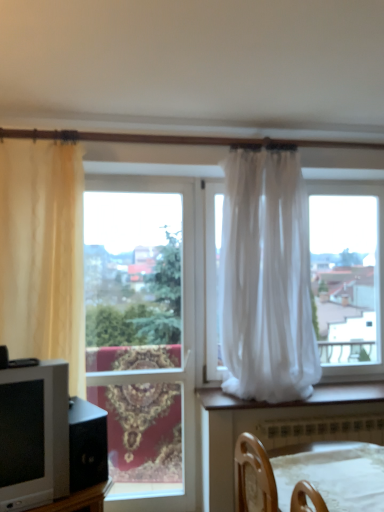
Question: Is wooden chair at lower center closer to camera compared to clear glass window at center?

Choices:
 (A) no
 (B) yes

Answer: (B)

Question: Are wooden chair at lower center and clear glass window at center beside each other?

Choices:
 (A) yes
 (B) no

Answer: (B)

Question: From a real-world perspective, is wooden chair at lower center physically above clear glass window at center?

Choices:
 (A) yes
 (B) no

Answer: (B)

Question: Is clear glass window at center surrounded by wooden chair at lower center?

Choices:
 (A) yes
 (B) no

Answer: (B)

Question: From the image's perspective, is wooden chair at lower center above clear glass window at center?

Choices:
 (A) yes
 (B) no

Answer: (B)

Question: Visually, is beige sheer curtain at left, acting as the 2th curtain starting from the right, positioned to the left or to the right of clear glass window at center?

Choices:
 (A) right
 (B) left

Answer: (B)

Question: Considering the positions of beige sheer curtain at left, which is counted as the 1th curtain, starting from the left, and clear glass window at center in the image, is beige sheer curtain at left, which is counted as the 1th curtain, starting from the left, wider or thinner than clear glass window at center?

Choices:
 (A) wide
 (B) thin

Answer: (A)

Question: From the image's perspective, is beige sheer curtain at left, which is counted as the 1th curtain, starting from the left, above or below clear glass window at center?

Choices:
 (A) below
 (B) above

Answer: (B)

Question: Looking at the image, does beige sheer curtain at left, which is counted as the 1th curtain, starting from the left, seem bigger or smaller compared to clear glass window at center?

Choices:
 (A) big
 (B) small

Answer: (A)

Question: Is point (296, 222) positioned closer to the camera than point (51, 404)?

Choices:
 (A) farther
 (B) closer

Answer: (A)

Question: Visually, is white sheer curtain at center, which ranks as the 1th curtain in right-to-left order, positioned to the left or to the right of matte gray tv at left?

Choices:
 (A) left
 (B) right

Answer: (B)

Question: Is white sheer curtain at center, the second curtain viewed from the left, in front of or behind matte gray tv at left in the image?

Choices:
 (A) front
 (B) behind

Answer: (B)

Question: Is white sheer curtain at center, which ranks as the 1th curtain in right-to-left order, situated inside matte gray tv at left or outside?

Choices:
 (A) outside
 (B) inside

Answer: (A)

Question: From the image's perspective, is beige sheer curtain at left, which is counted as the 1th curtain, starting from the left, located above or below matte gray tv at left?

Choices:
 (A) above
 (B) below

Answer: (A)

Question: From a real-world perspective, relative to matte gray tv at left, is beige sheer curtain at left, which is counted as the 1th curtain, starting from the left, vertically above or below?

Choices:
 (A) above
 (B) below

Answer: (A)